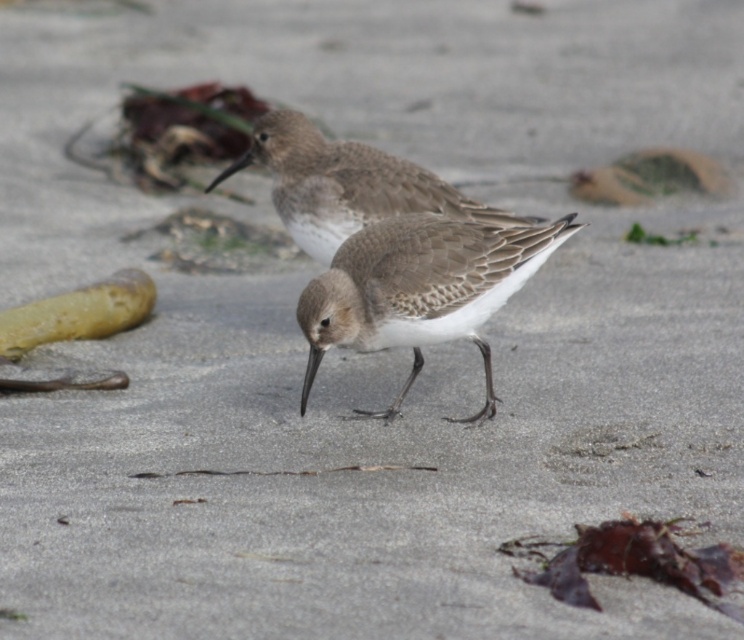
Who is shorter, brown speckled sandpiper at center or brown feathered bird at center?

With less height is brown feathered bird at center.

Is point (436, 300) closer to camera compared to point (307, 129)?

That is True.

Image resolution: width=744 pixels, height=640 pixels. I want to click on brown speckled sandpiper at center, so click(x=420, y=289).

Find the location of a particular element. Image resolution: width=744 pixels, height=640 pixels. brown speckled sandpiper at center is located at coordinates (420, 289).